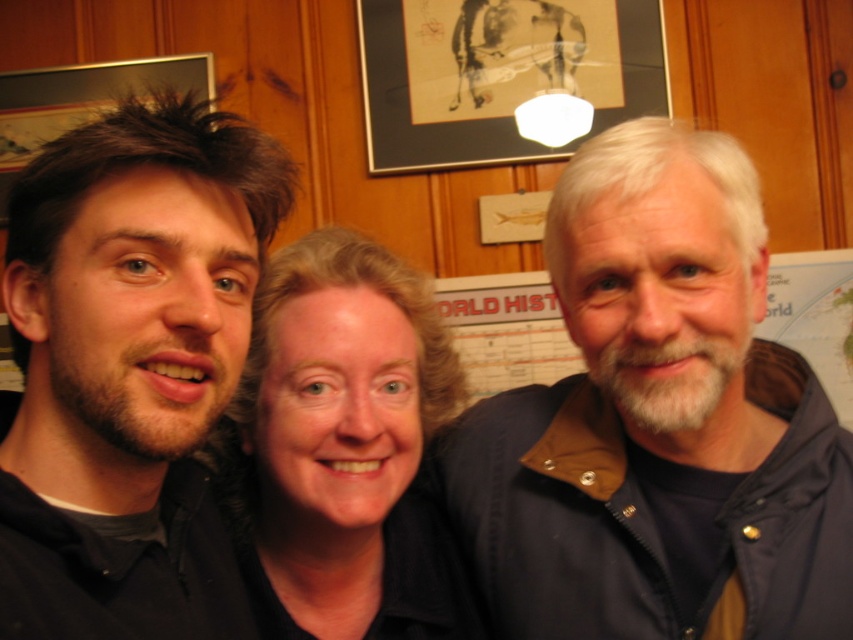
You are taking a photo of three people standing in front of a wooden panel background. You notice two points in the image labeled as point (45, 339) and point (587, 51). Which point is closer to you?

Point (45, 339) is closer to the camera than point (587, 51).

You are standing in front of the three people in the photo. You want to hand a gift to the person wearing the black matte shirt at center. However, there is a black matte picture frame at upper center blocking your path. Can you reach the person without moving the frame?

The black matte shirt at center is to the left of the black matte picture frame at upper center, so you can reach the person by approaching from the left side of the frame.